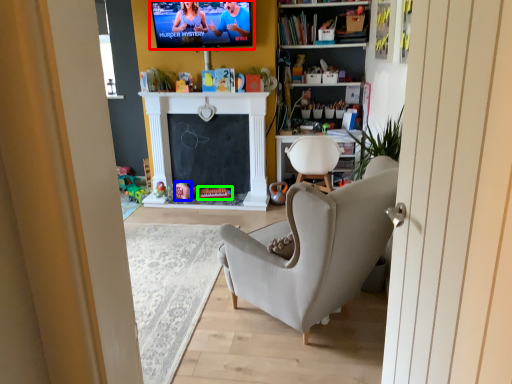
Question: Which object is positioned closest to tv show (highlighted by a red box)? Select from toy (highlighted by a blue box) and toy (highlighted by a green box).

Choices:
 (A) toy
 (B) toy

Answer: (A)